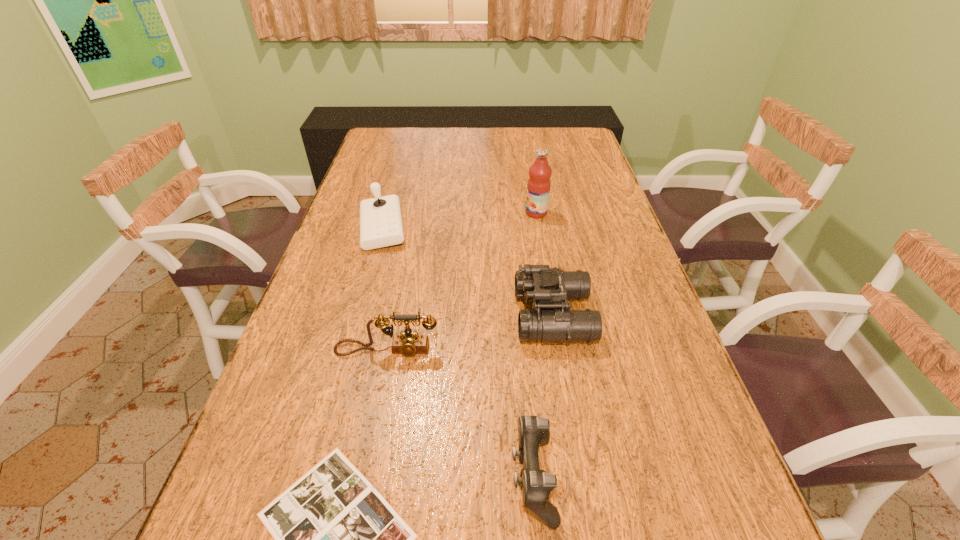
Locate an element on the screen. This screenshot has width=960, height=540. free point at the right edge is located at coordinates (597, 189).

The width and height of the screenshot is (960, 540). I want to click on free spot between the control and the binoculars, so click(543, 396).

Find the location of `empty space that is in between the telephone and the fruit juice`. empty space that is in between the telephone and the fruit juice is located at coordinates (x=462, y=281).

The height and width of the screenshot is (540, 960). What are the coordinates of `vacant space in between the joystick and the control` in the screenshot? It's located at (457, 353).

You are a GUI agent. You are given a task and a screenshot of the screen. Output one action in this format:
    pyautogui.click(x=<x>, y=<y>)
    Task: Click on the vacant area between the control and the tallest object
    
    Given the screenshot: What is the action you would take?
    pyautogui.click(x=535, y=345)

Find the location of a particular element. vacant space that's between the control and the telephone is located at coordinates (460, 414).

You are a GUI agent. You are given a task and a screenshot of the screen. Output one action in this format:
    pyautogui.click(x=<x>, y=<y>)
    Task: Click on the vacant area that lies between the joystick and the binoculars
    The height and width of the screenshot is (540, 960).
    Given the screenshot: What is the action you would take?
    pyautogui.click(x=468, y=272)

This screenshot has height=540, width=960. Identify the location of the second closest object relative to the control. (549, 288).

Image resolution: width=960 pixels, height=540 pixels. In order to click on object that ranks as the closest to the binoculars in this screenshot , I will do `click(408, 343)`.

The height and width of the screenshot is (540, 960). What are the coordinates of `free spot that satisfies the following two spatial constraints: 1. on the front label of the fruit juice; 2. on the front-facing side of the telephone` in the screenshot? It's located at (560, 350).